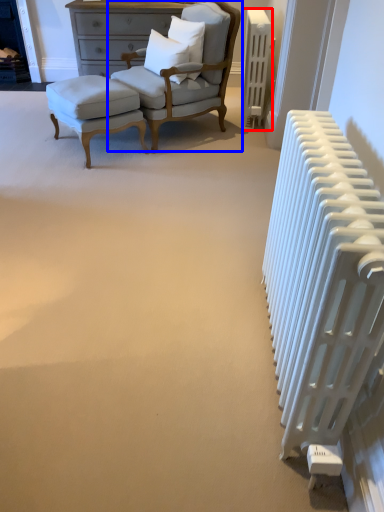
Question: Among these objects, which one is farthest to the camera, radiator (highlighted by a red box) or chair (highlighted by a blue box)?

Choices:
 (A) radiator
 (B) chair

Answer: (A)